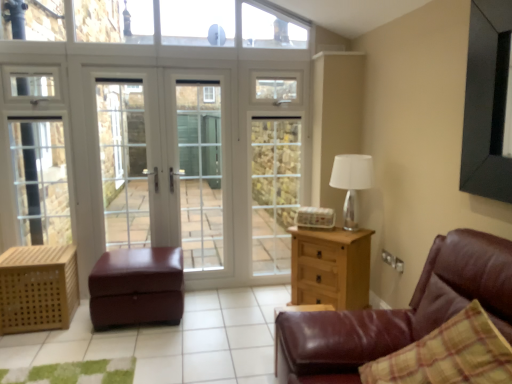
Question: Can you confirm if clear glass window at upper center is shorter than light wood/texture chest of drawers at right?

Choices:
 (A) yes
 (B) no

Answer: (A)

Question: From a real-world perspective, is clear glass window at upper center beneath light wood/texture chest of drawers at right?

Choices:
 (A) yes
 (B) no

Answer: (B)

Question: Is light wood/texture chest of drawers at right inside clear glass window at upper center?

Choices:
 (A) no
 (B) yes

Answer: (A)

Question: Is clear glass window at upper center facing away from light wood/texture chest of drawers at right?

Choices:
 (A) yes
 (B) no

Answer: (B)

Question: Can you confirm if clear glass window at upper center is bigger than light wood/texture chest of drawers at right?

Choices:
 (A) no
 (B) yes

Answer: (A)

Question: In terms of height, does wooden crate at lower left look taller or shorter compared to silver metallic table lamp at upper right?

Choices:
 (A) short
 (B) tall

Answer: (A)

Question: In terms of width, does wooden crate at lower left look wider or thinner when compared to silver metallic table lamp at upper right?

Choices:
 (A) thin
 (B) wide

Answer: (B)

Question: From the image's perspective, is wooden crate at lower left located above or below silver metallic table lamp at upper right?

Choices:
 (A) below
 (B) above

Answer: (A)

Question: Is wooden crate at lower left inside or outside of silver metallic table lamp at upper right?

Choices:
 (A) outside
 (B) inside

Answer: (A)

Question: Do you think clear glass window at upper center is within white glass screen door at center, acting as the second screen door starting from the left, or outside of it?

Choices:
 (A) inside
 (B) outside

Answer: (B)

Question: Looking at the image, does clear glass window at upper center seem bigger or smaller compared to white glass screen door at center, the 2th screen door viewed from the right?

Choices:
 (A) small
 (B) big

Answer: (B)

Question: In the image, is clear glass window at upper center positioned in front of or behind white glass screen door at center, acting as the second screen door starting from the left?

Choices:
 (A) behind
 (B) front

Answer: (B)

Question: Is point (248, 13) positioned closer to the camera than point (204, 244)?

Choices:
 (A) farther
 (B) closer

Answer: (B)

Question: Is clear glass window at upper center bigger or smaller than silver metallic table lamp at upper right?

Choices:
 (A) big
 (B) small

Answer: (A)

Question: Would you say clear glass window at upper center is to the left or to the right of silver metallic table lamp at upper right in the picture?

Choices:
 (A) right
 (B) left

Answer: (B)